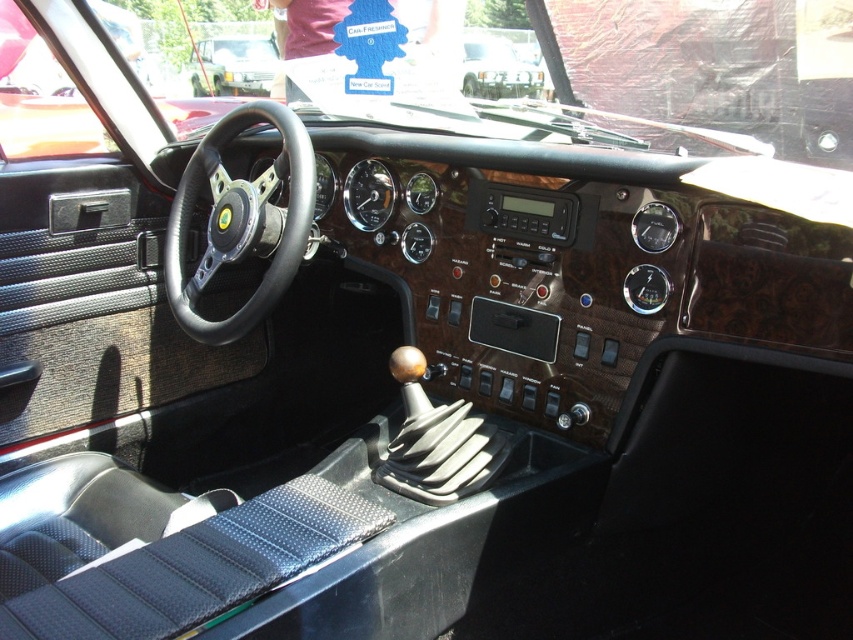
Between black leather steering wheel at center and metallic silver car at upper center, which one is positioned higher?

metallic silver car at upper center is above.

Can you confirm if black leather steering wheel at center is positioned above metallic silver car at upper center?

No.

Between point (207, 342) and point (474, 86), which one is positioned in front?

Point (207, 342) is in front.

Where is `black leather steering wheel at center`? black leather steering wheel at center is located at coordinates (241, 220).

In the scene shown: Is black leather steering wheel at center closer to camera compared to matte black steering wheel at center?

Yes, black leather steering wheel at center is closer to the viewer.

Where is `black leather steering wheel at center`? The width and height of the screenshot is (853, 640). black leather steering wheel at center is located at coordinates (241, 220).

Can you confirm if matte black steering wheel at center is positioned to the left of metallic silver car at upper center?

Correct, you'll find matte black steering wheel at center to the left of metallic silver car at upper center.

Does matte black steering wheel at center appear on the right side of metallic silver car at upper center?

Incorrect, matte black steering wheel at center is not on the right side of metallic silver car at upper center.

Who is more forward, (196,44) or (540,90)?

Point (540,90) is in front.

Image resolution: width=853 pixels, height=640 pixels. Identify the location of matte black steering wheel at center. (233, 65).